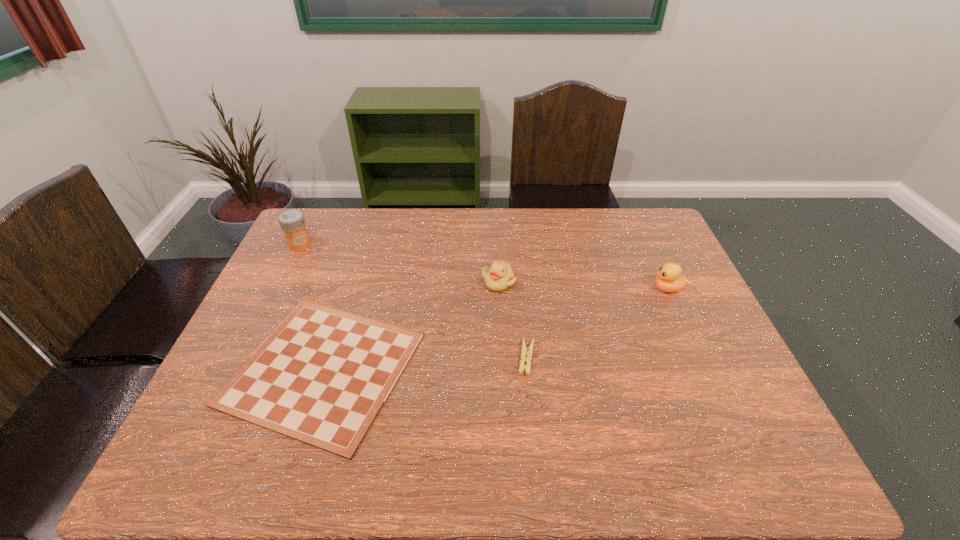
Find the location of a particular element. empty space between the clothespin and the right duckling is located at coordinates (597, 323).

The height and width of the screenshot is (540, 960). Identify the location of free space that is in between the second shortest object and the farthest object. (414, 301).

Identify the location of unoccupied position between the checkerboard and the clothespin. This screenshot has height=540, width=960. (425, 363).

I want to click on vacant region between the left duckling and the clothespin, so click(x=513, y=320).

Identify which object is the second closest to the farthest object. Please provide its 2D coordinates. Your answer should be formatted as a tuple, i.e. [(x, y)], where the tuple contains the x and y coordinates of a point satisfying the conditions above.

[(499, 277)]

You are a GUI agent. You are given a task and a screenshot of the screen. Output one action in this format:
    pyautogui.click(x=<x>, y=<y>)
    Task: Click on the third closest object relative to the tallest object
    
    Given the screenshot: What is the action you would take?
    pyautogui.click(x=525, y=350)

The width and height of the screenshot is (960, 540). Identify the location of vacant space that satisfies the following two spatial constraints: 1. on the label side of the shortest object; 2. on the right side of the medicine. (239, 368).

I want to click on free region that satisfies the following two spatial constraints: 1. on the face of the rightmost object; 2. on the front side of the clothespin, so click(699, 357).

At what (x,y) coordinates should I click in order to perform the action: click on free space in the image that satisfies the following two spatial constraints: 1. on the label side of the tallest object; 2. on the right side of the second shortest object. Please return your answer as a coordinate pair (x, y). The image size is (960, 540). Looking at the image, I should click on (245, 357).

Locate an element on the screen. free space that satisfies the following two spatial constraints: 1. on the face of the right duckling; 2. on the front side of the fourth tallest object is located at coordinates (699, 357).